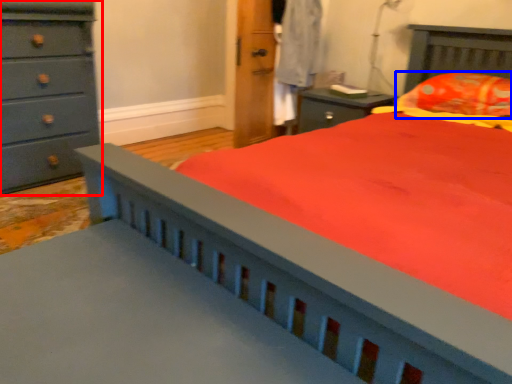
Question: Which object appears farthest to the camera in this image, chest of drawers (highlighted by a red box) or pillow (highlighted by a blue box)?

Choices:
 (A) chest of drawers
 (B) pillow

Answer: (A)